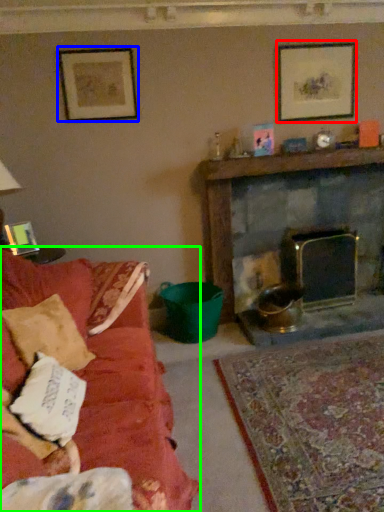
Question: Considering the real-world distances, which object is farthest from picture frame (highlighted by a red box)? picture frame (highlighted by a blue box) or studio couch (highlighted by a green box)?

Choices:
 (A) picture frame
 (B) studio couch

Answer: (B)